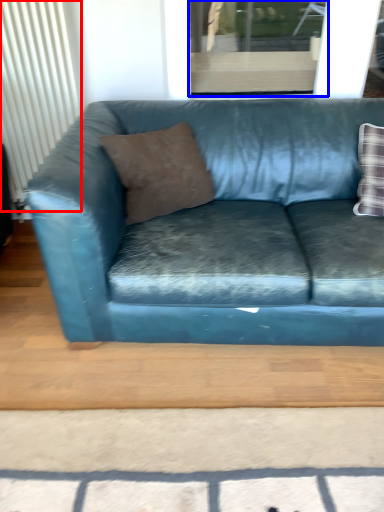
Question: Among these objects, which one is farthest to the camera, radiator (highlighted by a red box) or window (highlighted by a blue box)?

Choices:
 (A) radiator
 (B) window

Answer: (B)